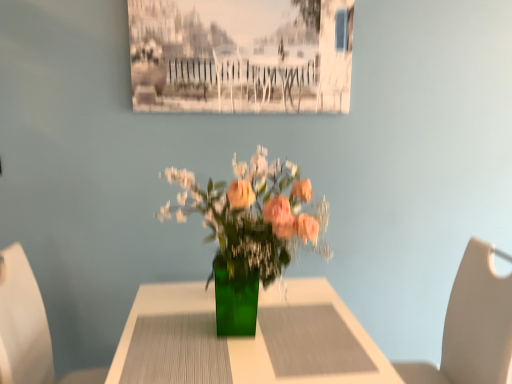
Question: Is beige leather chair at right, the 2th chair when ordered from left to right, taller or shorter than white plastic chair at left, placed as the 2th chair when sorted from right to left?

Choices:
 (A) tall
 (B) short

Answer: (A)

Question: Does point (474, 367) appear closer or farther from the camera than point (47, 336)?

Choices:
 (A) closer
 (B) farther

Answer: (A)

Question: Which is nearer to the white plastic chair at left, which is counted as the first chair, starting from the left?

Choices:
 (A) beige leather chair at right, the 2th chair when ordered from left to right
 (B) green glass vase at center

Answer: (B)

Question: Which object is positioned farthest from the green glass vase at center?

Choices:
 (A) beige leather chair at right, the 2th chair when ordered from left to right
 (B) white plastic chair at left, which is counted as the first chair, starting from the left

Answer: (A)